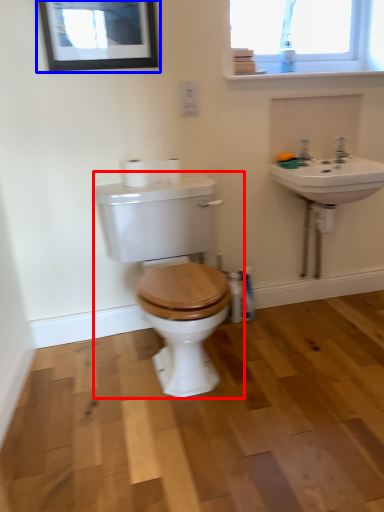
Question: Which object appears farthest to the camera in this image, toilet (highlighted by a red box) or picture frame (highlighted by a blue box)?

Choices:
 (A) toilet
 (B) picture frame

Answer: (B)